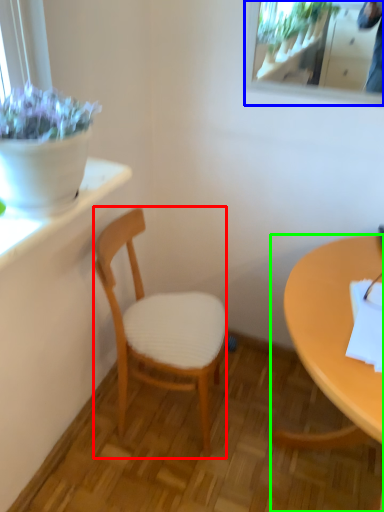
Question: Estimate the real-world distances between objects in this image. Which object is farther from chair (highlighted by a red box), mirror (highlighted by a blue box) or desk (highlighted by a green box)?

Choices:
 (A) mirror
 (B) desk

Answer: (A)